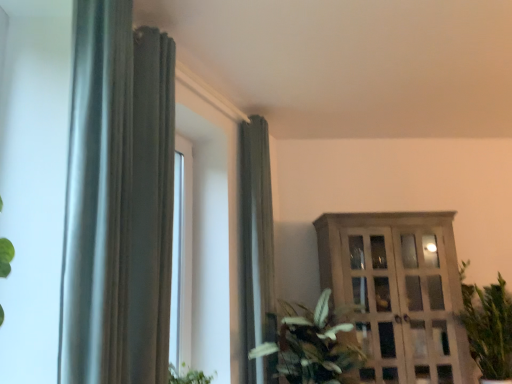
Question: Considering the relative sizes of wooden cabinet at right and green leafy plant at center, which is counted as the 2th houseplant, starting from the right, in the image provided, is wooden cabinet at right shorter than green leafy plant at center, which is counted as the 2th houseplant, starting from the right,?

Choices:
 (A) yes
 (B) no

Answer: (B)

Question: Is wooden cabinet at right not inside green leafy plant at center, which is counted as the 2th houseplant, starting from the right?

Choices:
 (A) yes
 (B) no

Answer: (A)

Question: Is wooden cabinet at right far from green leafy plant at center, the 1th houseplant in the left-to-right sequence?

Choices:
 (A) no
 (B) yes

Answer: (A)

Question: Is the depth of wooden cabinet at right less than that of green leafy plant at center, which is counted as the 2th houseplant, starting from the right?

Choices:
 (A) no
 (B) yes

Answer: (A)

Question: Considering the relative sizes of wooden cabinet at right and green leafy plant at center, which is counted as the 2th houseplant, starting from the right, in the image provided, is wooden cabinet at right smaller than green leafy plant at center, which is counted as the 2th houseplant, starting from the right,?

Choices:
 (A) yes
 (B) no

Answer: (B)

Question: From a real-world perspective, relative to satin gray curtain at center, the first curtain from the back, is green leafy plant at right, marked as the second houseplant in a left-to-right arrangement, vertically above or below?

Choices:
 (A) above
 (B) below

Answer: (B)

Question: Is green leafy plant at right, marked as the 1th houseplant in a right-to-left arrangement, taller or shorter than satin gray curtain at center, the 2th curtain viewed from the front?

Choices:
 (A) short
 (B) tall

Answer: (A)

Question: Is green leafy plant at right, marked as the 1th houseplant in a right-to-left arrangement, wider or thinner than satin gray curtain at center, the 2th curtain viewed from the front?

Choices:
 (A) thin
 (B) wide

Answer: (B)

Question: Does point (502, 344) appear closer or farther from the camera than point (264, 223)?

Choices:
 (A) closer
 (B) farther

Answer: (B)

Question: In terms of size, does green leafy plant at center, which is counted as the 2th houseplant, starting from the right, appear bigger or smaller than satin gray curtain at center, the first curtain viewed from the right?

Choices:
 (A) big
 (B) small

Answer: (A)

Question: Is green leafy plant at center, the 1th houseplant in the left-to-right sequence, inside or outside of satin gray curtain at center, the first curtain viewed from the right?

Choices:
 (A) inside
 (B) outside

Answer: (B)

Question: Considering the positions of point (300, 345) and point (272, 279), is point (300, 345) closer or farther from the camera than point (272, 279)?

Choices:
 (A) closer
 (B) farther

Answer: (A)

Question: In the image, is green leafy plant at center, which is counted as the 2th houseplant, starting from the right, on the left side or the right side of satin gray curtain at center, the 2th curtain from the left?

Choices:
 (A) left
 (B) right

Answer: (B)

Question: From the image's perspective, relative to wooden cabinet at right, is green leafy plant at center, which is counted as the 2th houseplant, starting from the right, above or below?

Choices:
 (A) below
 (B) above

Answer: (A)

Question: Is green leafy plant at center, the 1th houseplant in the left-to-right sequence, taller or shorter than wooden cabinet at right?

Choices:
 (A) tall
 (B) short

Answer: (B)